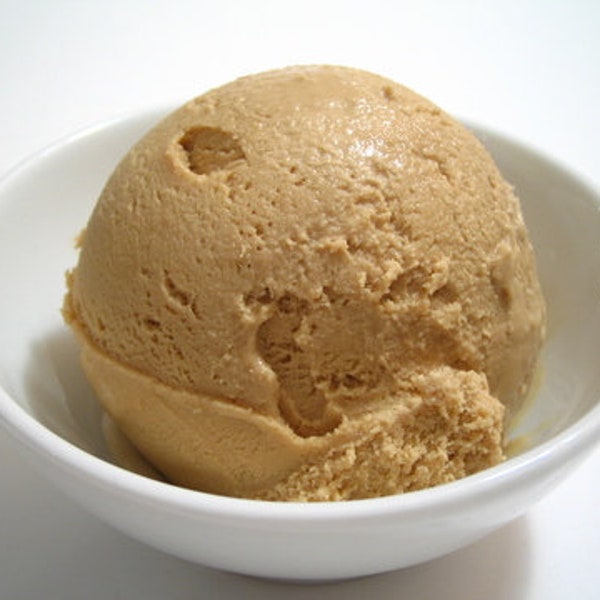
Locate an element on the screen. light gray surface of bowl is located at coordinates (263, 557).